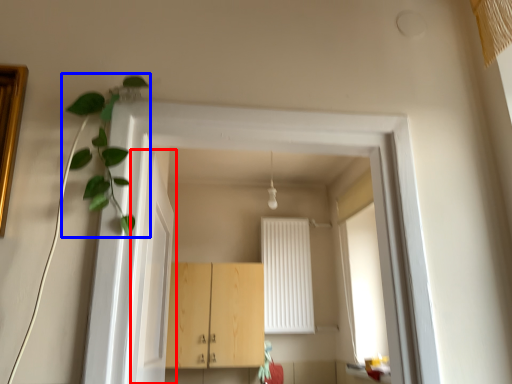
Question: Which object appears farthest to the camera in this image, door (highlighted by a red box) or plant (highlighted by a blue box)?

Choices:
 (A) door
 (B) plant

Answer: (A)